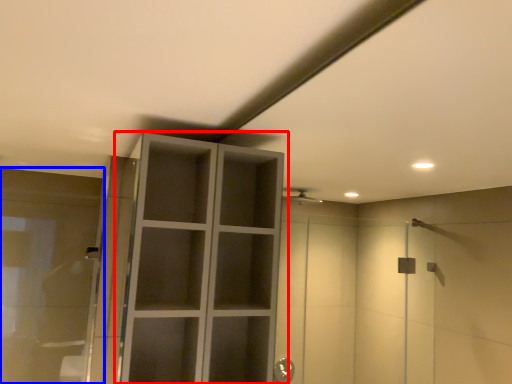
Question: Which object is further to the camera taking this photo, cupboard (highlighted by a red box) or cabinetry (highlighted by a blue box)?

Choices:
 (A) cupboard
 (B) cabinetry

Answer: (B)